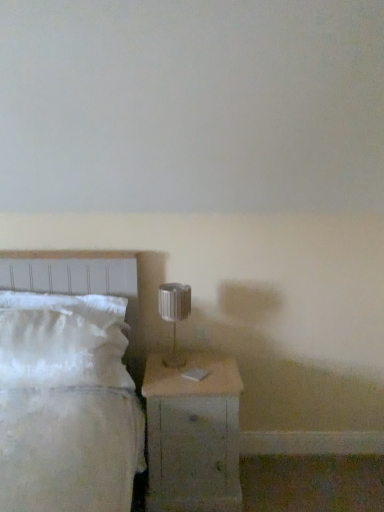
This screenshot has height=512, width=384. What are the coordinates of `vacant area located to the right-hand side of metallic silver table lamp at center` in the screenshot? It's located at (217, 361).